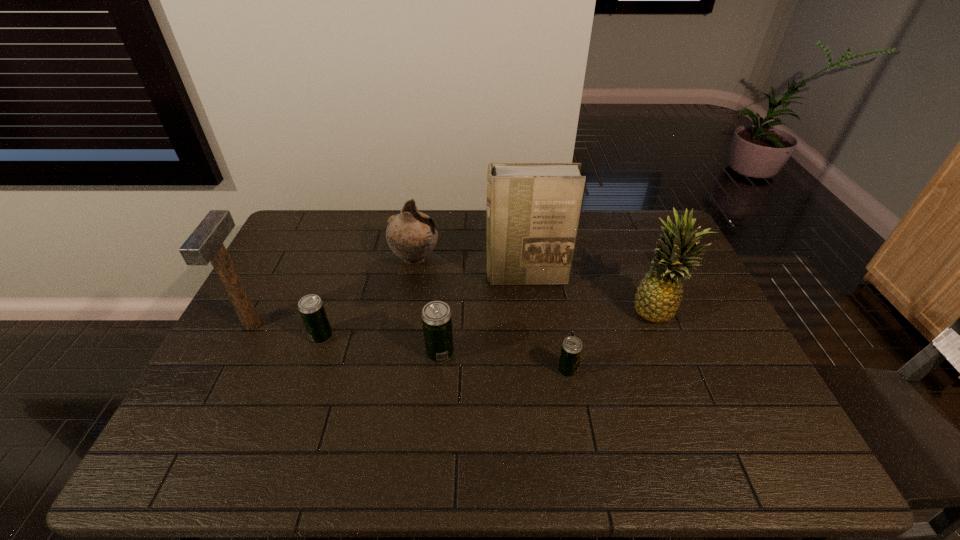
Please point a free position for a beer can on the right. Please provide its 2D coordinates. Your answer should be formatted as a tuple, i.e. [(x, y)], where the tuple contains the x and y coordinates of a point satisfying the conditions above.

[(704, 389)]